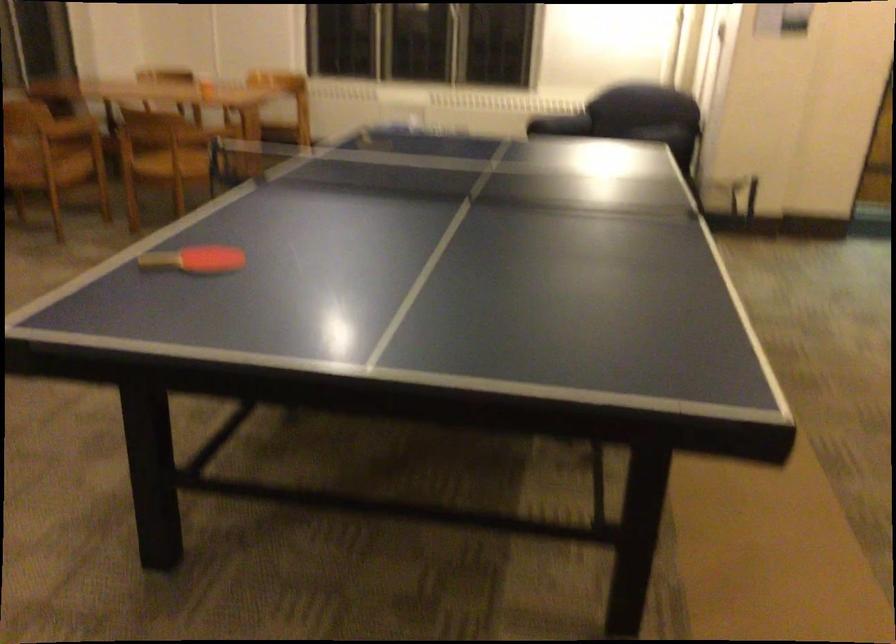
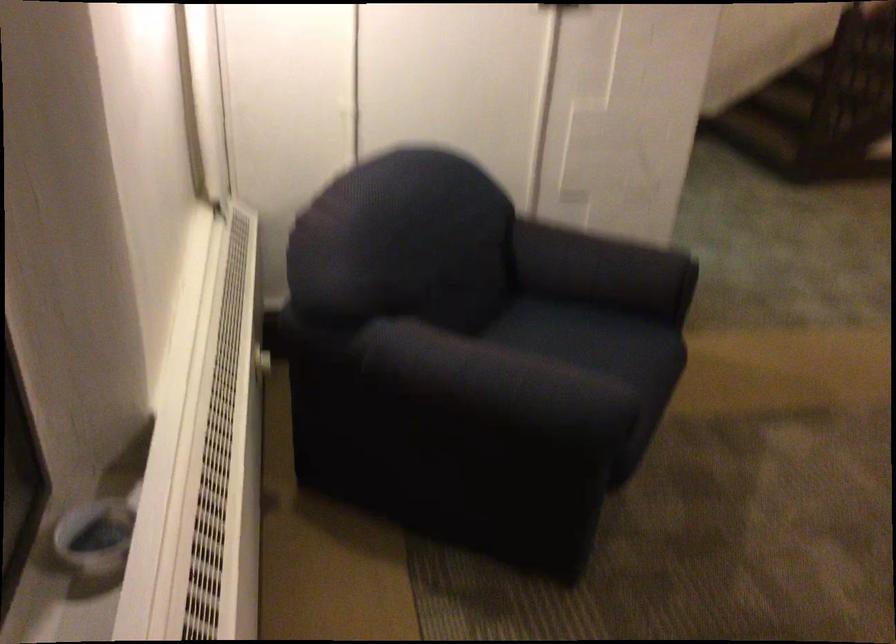
In the second image, find the point that corresponds to pixel 649 131 in the first image.

(604, 270)